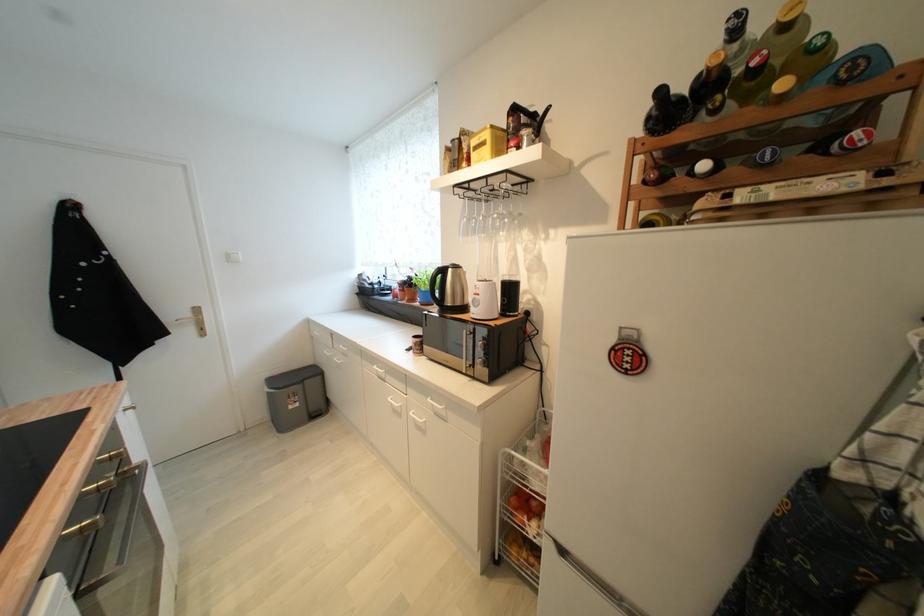
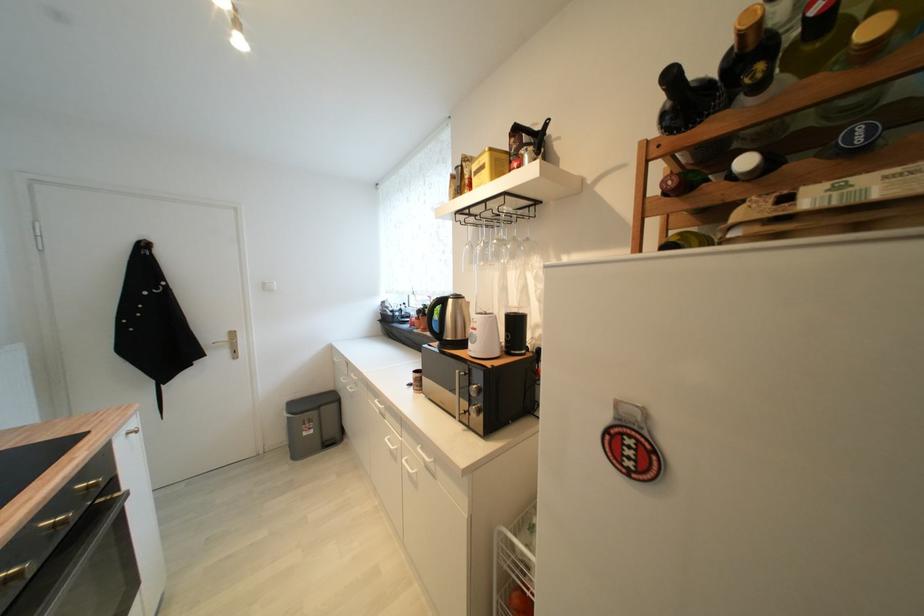
In the second image, find the point that corresponds to [296,408] in the first image.

(310, 436)